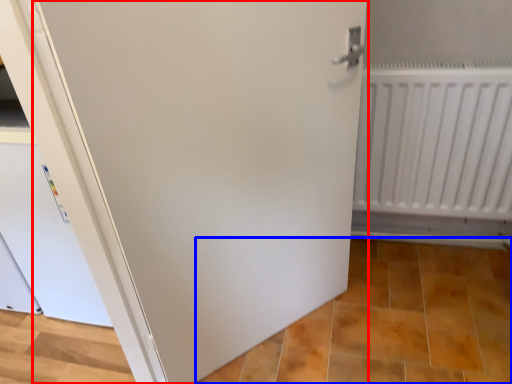
Question: Which object is closer to the camera taking this photo, door (highlighted by a red box) or tile (highlighted by a blue box)?

Choices:
 (A) door
 (B) tile

Answer: (A)